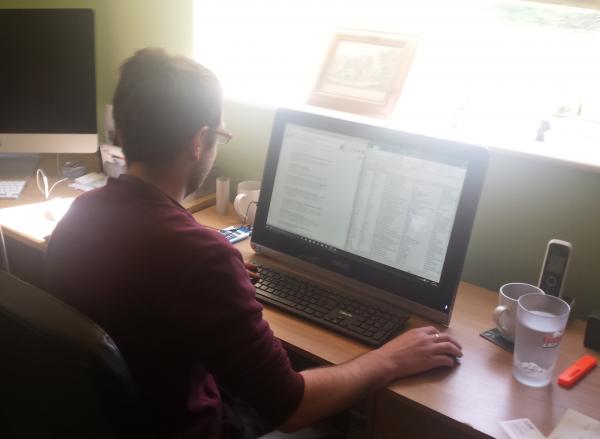
Where is `coffee cup handle`? coffee cup handle is located at coordinates (497, 317).